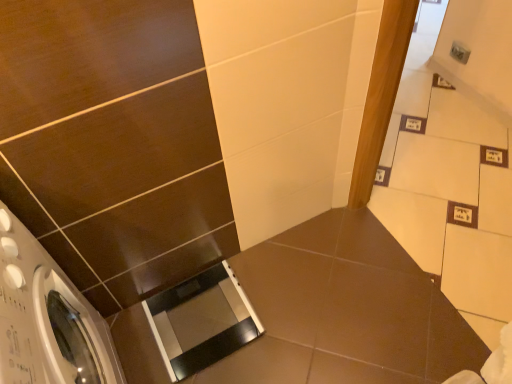
Locate an element on the screen. The width and height of the screenshot is (512, 384). blank space situated above transparent plastic screen door at lower center (from a real-world perspective) is located at coordinates (198, 316).